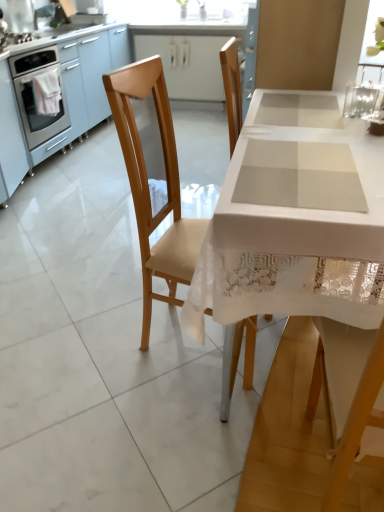
Question: Does point (41, 99) appear closer or farther from the camera than point (46, 91)?

Choices:
 (A) farther
 (B) closer

Answer: (B)

Question: From the image's perspective, is stainless steel oven at left positioned above or below pink fabric at left?

Choices:
 (A) above
 (B) below

Answer: (B)

Question: Which object is positioned closest to the pink fabric at left?

Choices:
 (A) stainless steel oven at left
 (B) matte white cabinet at upper center
 (C) wooden chair at left
 (D) white lace table at center

Answer: (A)

Question: Estimate the real-world distances between objects in this image. Which object is farther from the white lace table at center?

Choices:
 (A) pink fabric at left
 (B) wooden chair at left
 (C) stainless steel oven at left
 (D) matte white cabinet at upper center

Answer: (D)